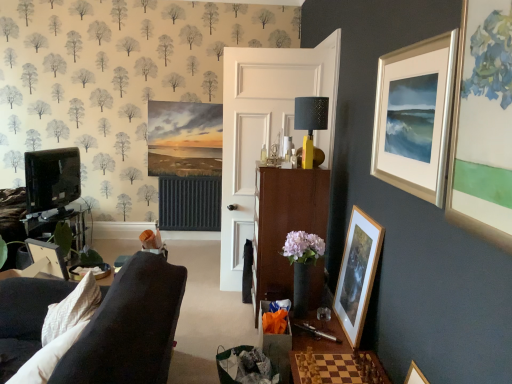
Locate an element on the screen. This screenshot has height=384, width=512. free point above silver metallic picture frame at upper right, the first picture frame when ordered from right to left (from a real-world perspective) is located at coordinates (411, 47).